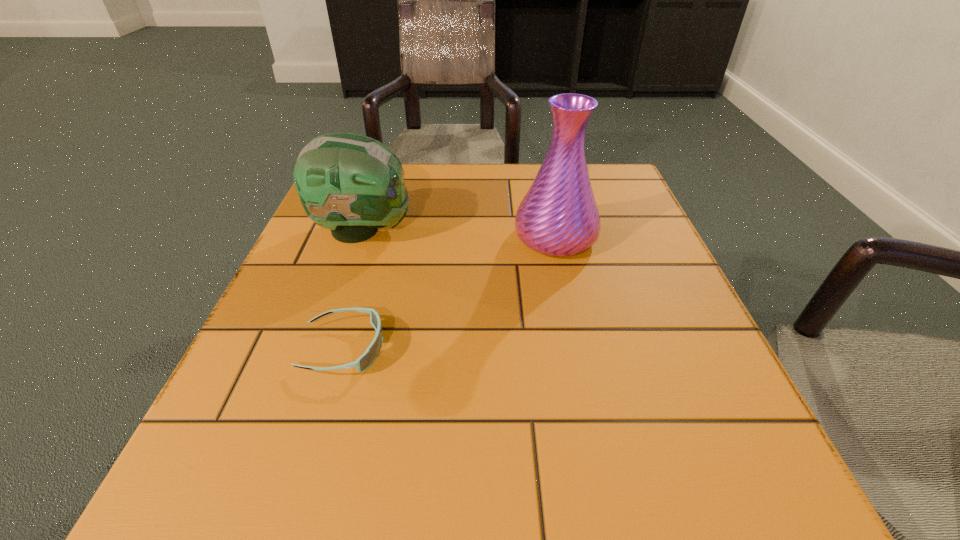
Image resolution: width=960 pixels, height=540 pixels. Identify the location of object that can be found as the closest to the rightmost object. (352, 184).

Select which object is the second closest to the vase. Please provide its 2D coordinates. Your answer should be formatted as a tuple, i.e. [(x, y)], where the tuple contains the x and y coordinates of a point satisfying the conditions above.

[(370, 355)]

You are a GUI agent. You are given a task and a screenshot of the screen. Output one action in this format:
    pyautogui.click(x=<x>, y=<y>)
    Task: Click on the free point that satisfies the following two spatial constraints: 1. on the visor of the second shortest object; 2. on the right side of the tallest object
    This screenshot has height=540, width=960.
    Given the screenshot: What is the action you would take?
    pyautogui.click(x=360, y=238)

This screenshot has width=960, height=540. Identify the location of vacant space that satisfies the following two spatial constraints: 1. on the visor of the second tallest object; 2. on the back side of the vase. (360, 238).

I want to click on free space that satisfies the following two spatial constraints: 1. on the visor of the second shortest object; 2. on the back side of the tallest object, so click(360, 238).

Identify the location of blank space that satisfies the following two spatial constraints: 1. on the visor of the vase; 2. on the left side of the second shortest object. This screenshot has height=540, width=960. (360, 238).

Identify the location of free space that satisfies the following two spatial constraints: 1. on the visor of the football helmet; 2. on the left side of the rightmost object. This screenshot has height=540, width=960. (360, 238).

The image size is (960, 540). I want to click on vacant region that satisfies the following two spatial constraints: 1. on the front side of the vase; 2. on the front-facing side of the shortest object, so click(579, 348).